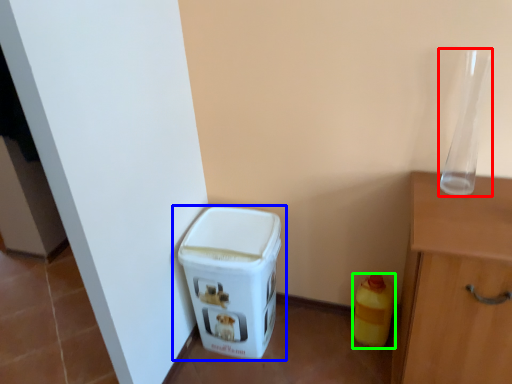
Question: Based on their relative distances, which object is farther from glass vase (highlighted by a red box)? Choose from waste container (highlighted by a blue box) and bottle (highlighted by a green box).

Choices:
 (A) waste container
 (B) bottle

Answer: (A)